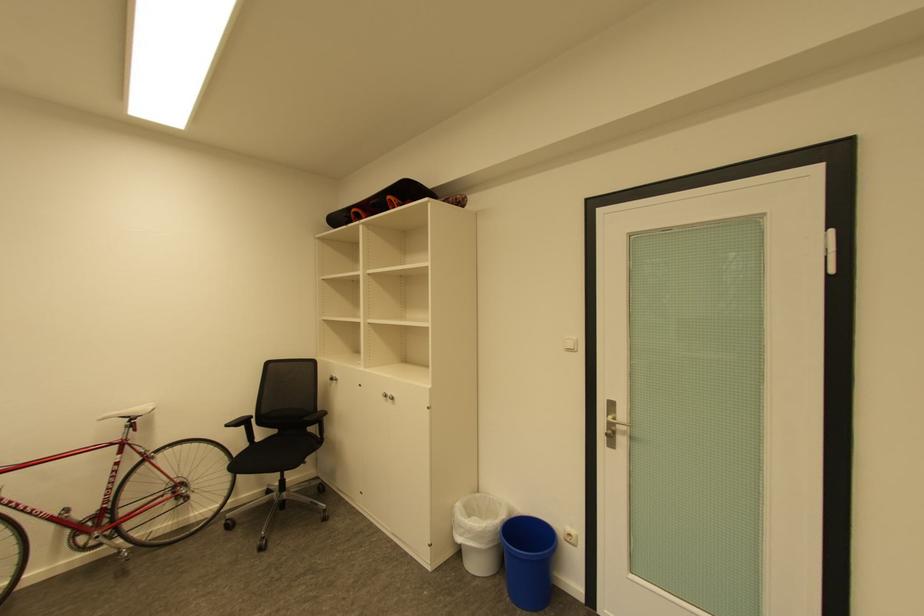
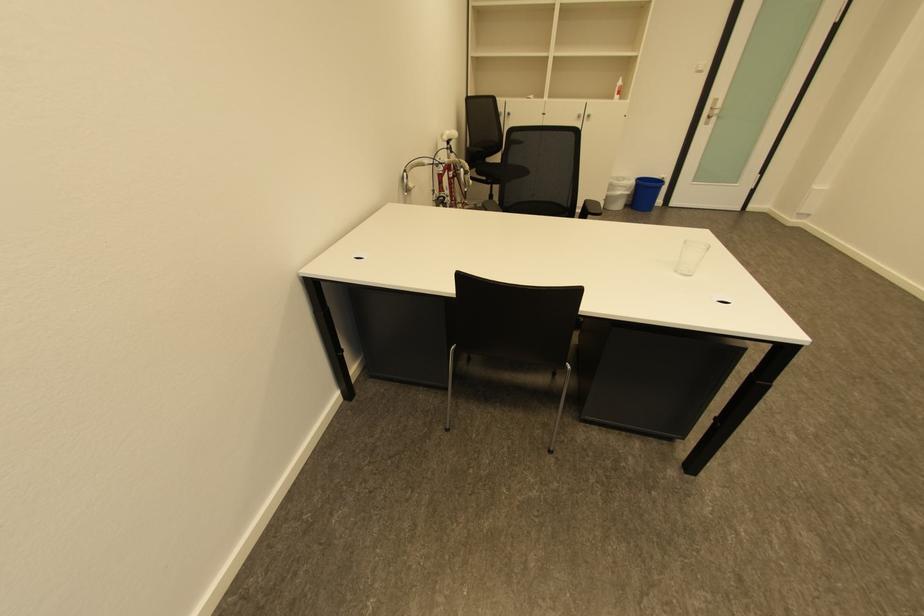
Where in the second image is the point corresponding to point (496, 549) from the first image?

(635, 196)